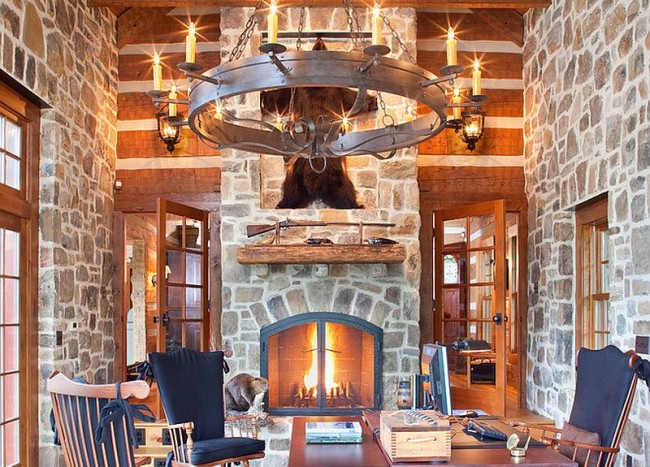
Find the location of a particular element. The image size is (650, 467). fireplace doors is located at coordinates (378, 347), (289, 322), (264, 362).